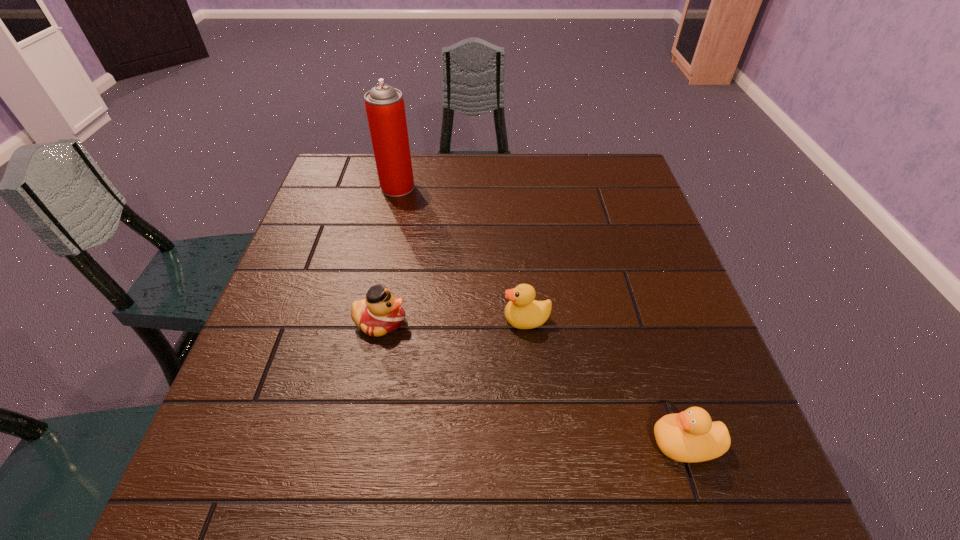
I want to click on the tallest object, so click(385, 109).

I want to click on aerosol can, so click(x=385, y=109).

I want to click on the leftmost duck, so tap(381, 312).

You are a GUI agent. You are given a task and a screenshot of the screen. Output one action in this format:
    pyautogui.click(x=<x>, y=<y>)
    Task: Click on the third object from left to right
    The image size is (960, 540).
    Given the screenshot: What is the action you would take?
    pyautogui.click(x=523, y=312)

Where is `the rightmost duck`? the rightmost duck is located at coordinates (690, 436).

Where is `the nearest object`? the nearest object is located at coordinates (690, 436).

Where is `free region located 0.320m on the right of the farthest object`? This screenshot has height=540, width=960. free region located 0.320m on the right of the farthest object is located at coordinates (525, 187).

You are a GUI agent. You are given a task and a screenshot of the screen. Output one action in this format:
    pyautogui.click(x=<x>, y=<y>)
    Task: Click on the vacant area situated on the face of the leftmost duck
    The width and height of the screenshot is (960, 540).
    Given the screenshot: What is the action you would take?
    pyautogui.click(x=548, y=322)

Identify the location of vacant space located at the beak of the second duck from left to right. (410, 319).

Where is `blank space located 0.370m at the beak of the second duck from left to right`? This screenshot has width=960, height=540. blank space located 0.370m at the beak of the second duck from left to right is located at coordinates (330, 319).